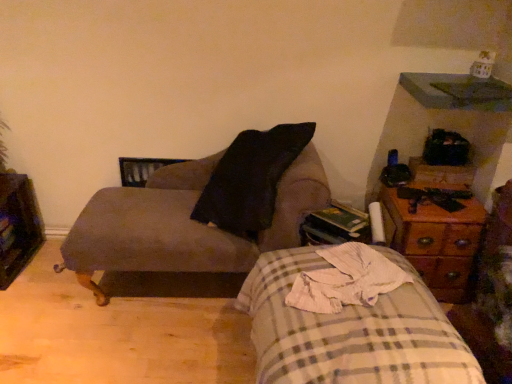
The height and width of the screenshot is (384, 512). In order to click on free location above woodenmaterial/texturenightstand at right (from a real-world perspective) in this screenshot , I will do `click(435, 196)`.